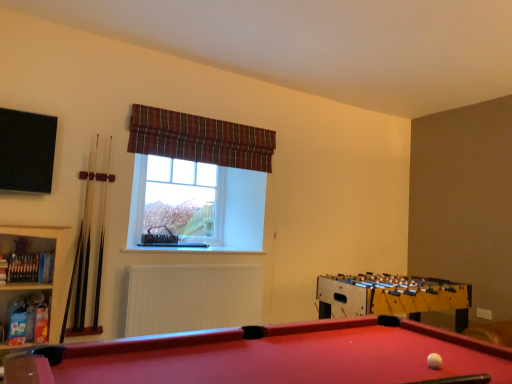
Question: Does wooden bookshelf at left have a smaller size compared to light brown wooden cue at left, acting as the first cue starting from the left?

Choices:
 (A) yes
 (B) no

Answer: (B)

Question: From a real-world perspective, is wooden bookshelf at left located beneath light brown wooden cue at left, the second cue in the right-to-left sequence?

Choices:
 (A) yes
 (B) no

Answer: (A)

Question: From the image's perspective, is wooden bookshelf at left above light brown wooden cue at left, the second cue in the right-to-left sequence?

Choices:
 (A) yes
 (B) no

Answer: (B)

Question: Would you say wooden bookshelf at left contains light brown wooden cue at left, the second cue in the right-to-left sequence?

Choices:
 (A) yes
 (B) no

Answer: (B)

Question: Is wooden bookshelf at left oriented away from light brown wooden cue at left, acting as the first cue starting from the left?

Choices:
 (A) no
 (B) yes

Answer: (A)

Question: Is wooden bookshelf at left not inside light brown wooden cue at left, the second cue in the right-to-left sequence?

Choices:
 (A) yes
 (B) no

Answer: (A)

Question: Is yellow wooden foosball table at right completely or partially outside of white wood cue at left, positioned as the second cue in left-to-right order?

Choices:
 (A) yes
 (B) no

Answer: (A)

Question: Is white wood cue at left, the first cue when ordered from right to left, at the back of yellow wooden foosball table at right?

Choices:
 (A) no
 (B) yes

Answer: (A)

Question: From a real-world perspective, is yellow wooden foosball table at right positioned over white wood cue at left, positioned as the second cue in left-to-right order, based on gravity?

Choices:
 (A) no
 (B) yes

Answer: (A)

Question: From the image's perspective, does yellow wooden foosball table at right appear lower than white wood cue at left, the first cue when ordered from right to left?

Choices:
 (A) yes
 (B) no

Answer: (A)

Question: Is yellow wooden foosball table at right next to white wood cue at left, positioned as the second cue in left-to-right order?

Choices:
 (A) yes
 (B) no

Answer: (B)

Question: Considering the relative sizes of yellow wooden foosball table at right and white wood cue at left, the first cue when ordered from right to left, in the image provided, is yellow wooden foosball table at right smaller than white wood cue at left, the first cue when ordered from right to left,?

Choices:
 (A) yes
 (B) no

Answer: (B)

Question: Is white wood cue at left, the first cue when ordered from right to left, next to clear glass window at center?

Choices:
 (A) yes
 (B) no

Answer: (B)